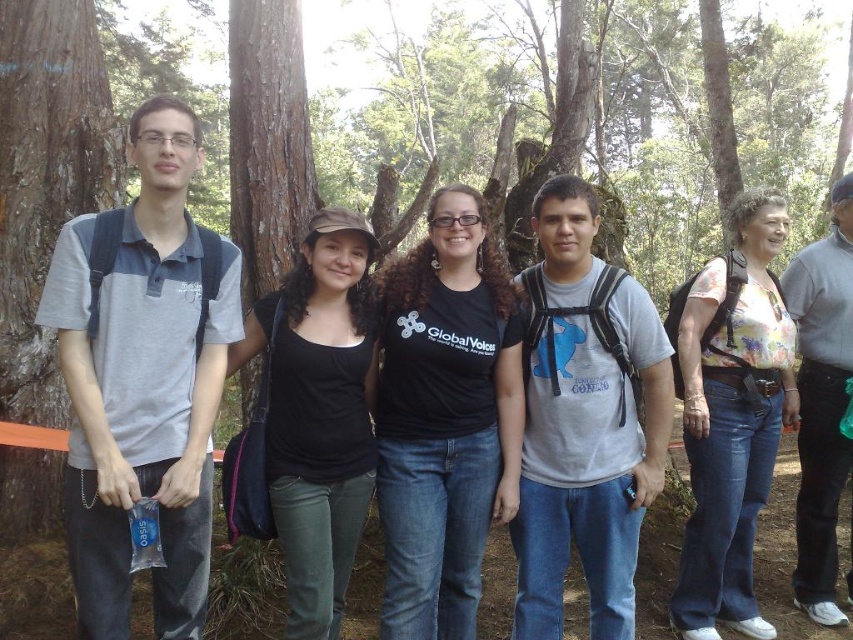
Does gray cotton polo shirt at left come behind gray matte t-shirt at center?

No, gray cotton polo shirt at left is closer to the viewer.

Who is lower down, gray cotton polo shirt at left or gray matte t-shirt at center?

gray matte t-shirt at center is lower down.

Who is more distant from viewer, (152, 480) or (546, 348)?

The point (546, 348) is more distant.

Where is `gray cotton polo shirt at left`? This screenshot has width=853, height=640. gray cotton polo shirt at left is located at coordinates (143, 384).

Who is positioned more to the right, black matte t-shirt at center or brown rough bark at left?

Positioned to the right is black matte t-shirt at center.

Does black matte t-shirt at center appear on the left side of brown rough bark at left?

No, black matte t-shirt at center is not to the left of brown rough bark at left.

The height and width of the screenshot is (640, 853). What do you see at coordinates (445, 419) in the screenshot?
I see `black matte t-shirt at center` at bounding box center [445, 419].

Locate an element on the screen. black matte t-shirt at center is located at coordinates (445, 419).

Between gray cotton polo shirt at left and black matte tank top at center, which one is positioned higher?

Positioned higher is gray cotton polo shirt at left.

The width and height of the screenshot is (853, 640). In order to click on gray cotton polo shirt at left in this screenshot , I will do `click(143, 384)`.